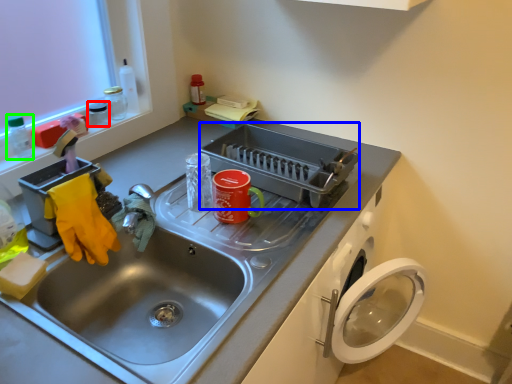
Question: Which object is the farthest from appliance (highlighted by a red box)? Choose among these: appliance (highlighted by a blue box) or bottle (highlighted by a green box).

Choices:
 (A) appliance
 (B) bottle

Answer: (A)